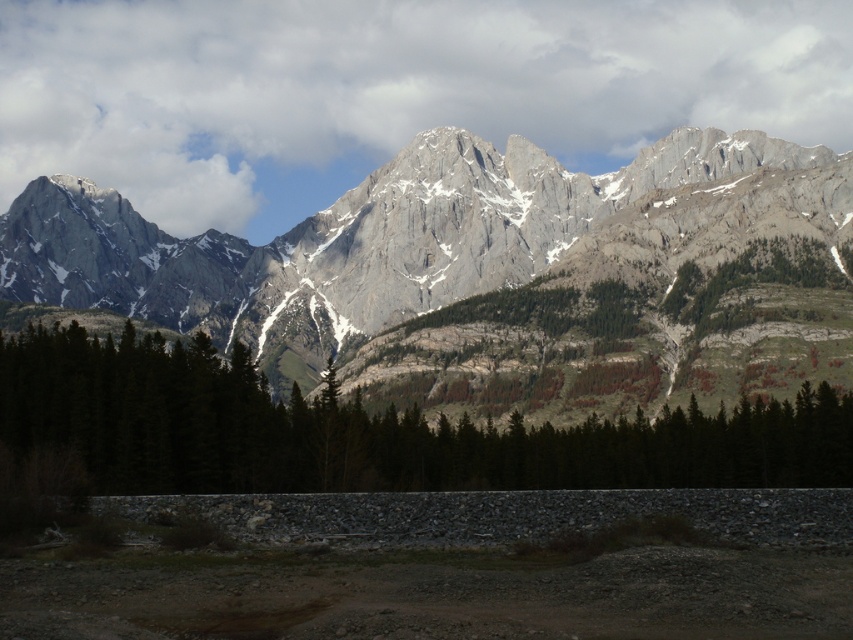
Question: Which point appears farthest from the camera in this image?

Choices:
 (A) (798, 458)
 (B) (318, 273)

Answer: (B)

Question: Among these objects, which one is nearest to the camera?

Choices:
 (A) gray rocky mountain range at upper center
 (B) green matte trees at center

Answer: (B)

Question: Does gray rocky mountain range at upper center appear on the left side of green matte trees at center?

Choices:
 (A) yes
 (B) no

Answer: (A)

Question: Does gray rocky mountain range at upper center have a larger size compared to green matte trees at center?

Choices:
 (A) no
 (B) yes

Answer: (B)

Question: Can you confirm if gray rocky mountain range at upper center is positioned to the right of green matte trees at center?

Choices:
 (A) yes
 (B) no

Answer: (B)